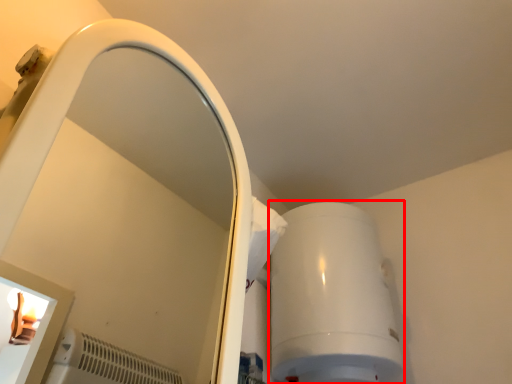
Question: Considering the relative positions of appliance (annotated by the red box) and mirror in the image provided, where is appliance (annotated by the red box) located with respect to the staircase?

Choices:
 (A) left
 (B) right

Answer: (B)